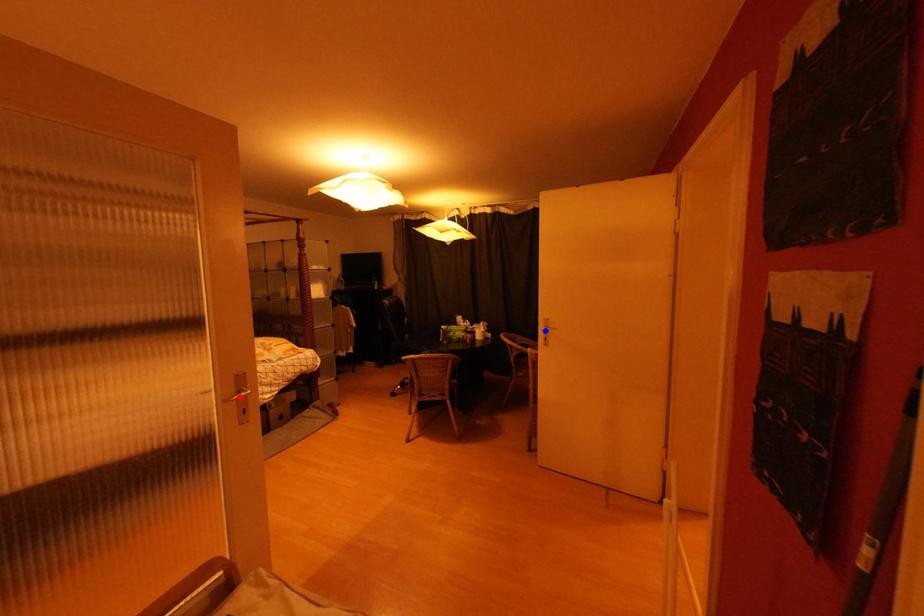
Question: Two points are marked on the image. Which point is closer to the camera?

Choices:
 (A) Blue point is closer.
 (B) Red point is closer.

Answer: (B)